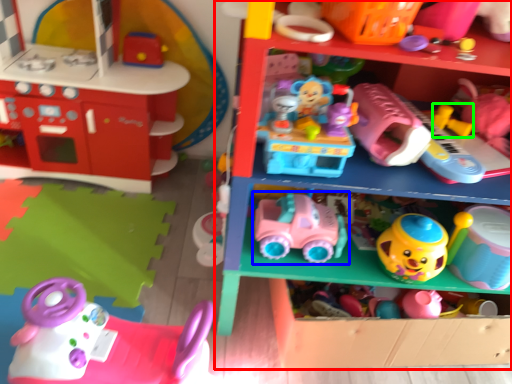
Question: Which object is the farthest from shelf (highlighted by a red box)? Choose among these: toy (highlighted by a blue box) or toy (highlighted by a green box).

Choices:
 (A) toy
 (B) toy

Answer: (B)